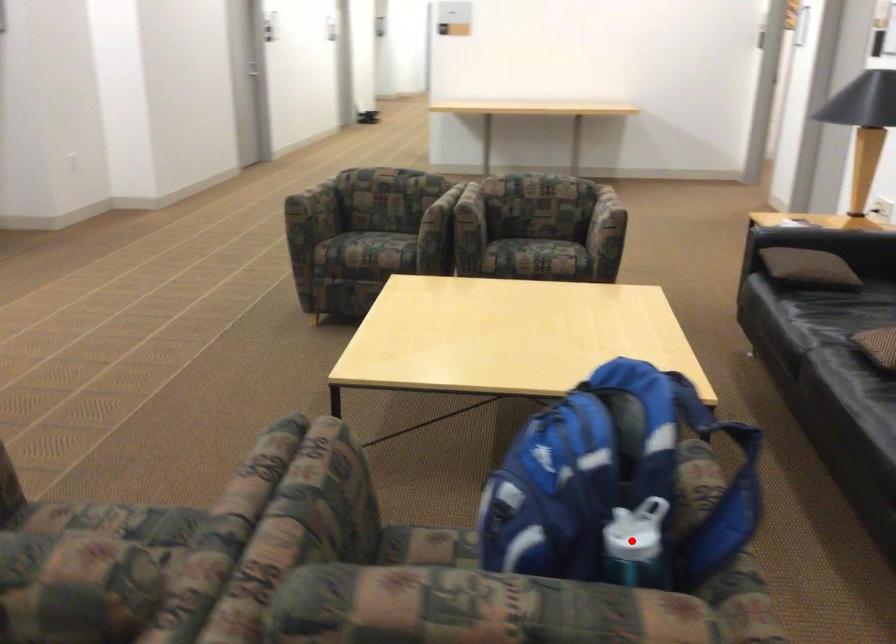
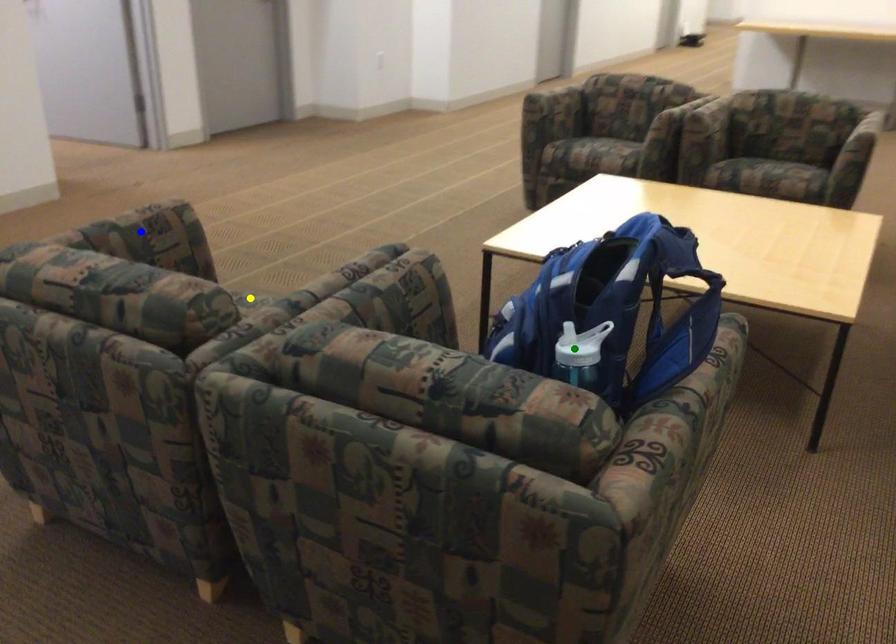
Question: I am providing you with two images of the same scene from different viewpoints. A red point is marked on the first image. You are given multiple points on the second image. Which spot in image 2 lines up with the point in image 1?

Choices:
 (A) yellow point
 (B) blue point
 (C) green point

Answer: (C)